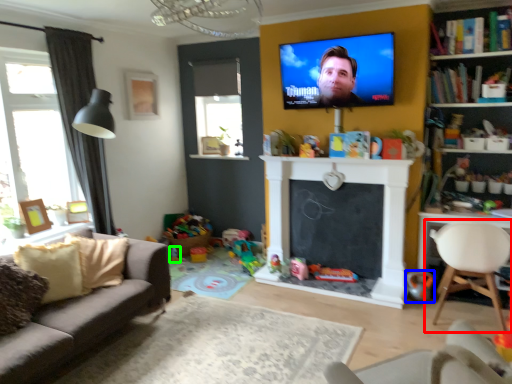
Question: Which object is the farthest from chair (highlighted by a red box)? Choose among these: toy (highlighted by a blue box) or toy (highlighted by a green box).

Choices:
 (A) toy
 (B) toy

Answer: (B)